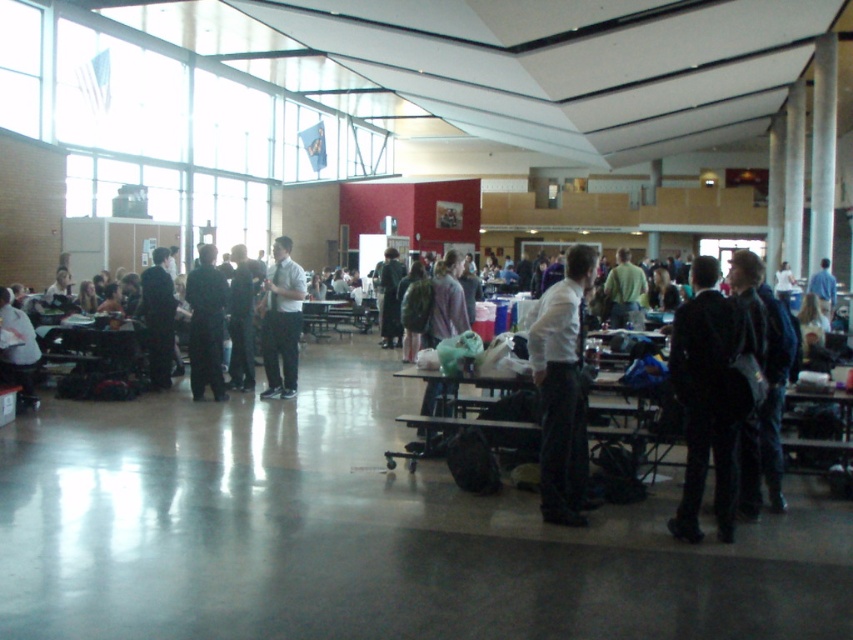
Question: Which is nearer to the matte black backpack at left?

Choices:
 (A) green matte shirt at center
 (B) dark gray suit at center
 (C) white shirt at center

Answer: (B)

Question: Is green matte shirt at center to the left of blue shirt at center from the viewer's perspective?

Choices:
 (A) no
 (B) yes

Answer: (B)

Question: Which point is closer to the camera taking this photo?

Choices:
 (A) (10, 346)
 (B) (216, 362)
 (C) (576, 458)

Answer: (C)

Question: Does white shirt at center have a greater width compared to blue shirt at center?

Choices:
 (A) yes
 (B) no

Answer: (B)

Question: Which object is the farthest from the dark suit at left?

Choices:
 (A) black suit at right
 (B) matte white shirt at center

Answer: (A)

Question: Is white shirt at center bigger than dark suit at left?

Choices:
 (A) no
 (B) yes

Answer: (A)